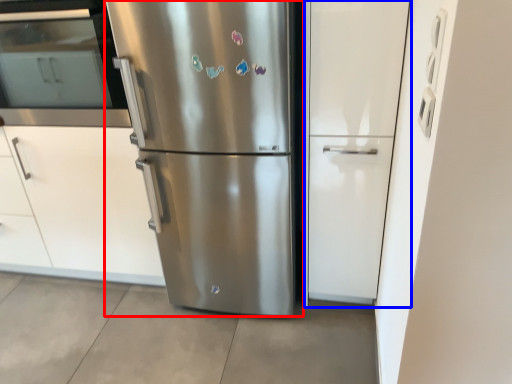
Question: Which point is further to the camera, refrigerator (highlighted by a red box) or glass door (highlighted by a blue box)?

Choices:
 (A) refrigerator
 (B) glass door

Answer: (B)